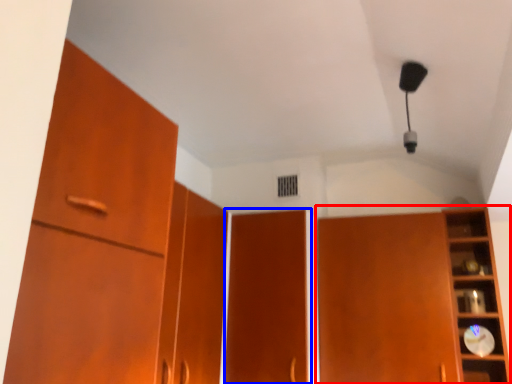
Question: Which of the following is the farthest to the observer, cupboard (highlighted by a red box) or door (highlighted by a blue box)?

Choices:
 (A) cupboard
 (B) door

Answer: (B)